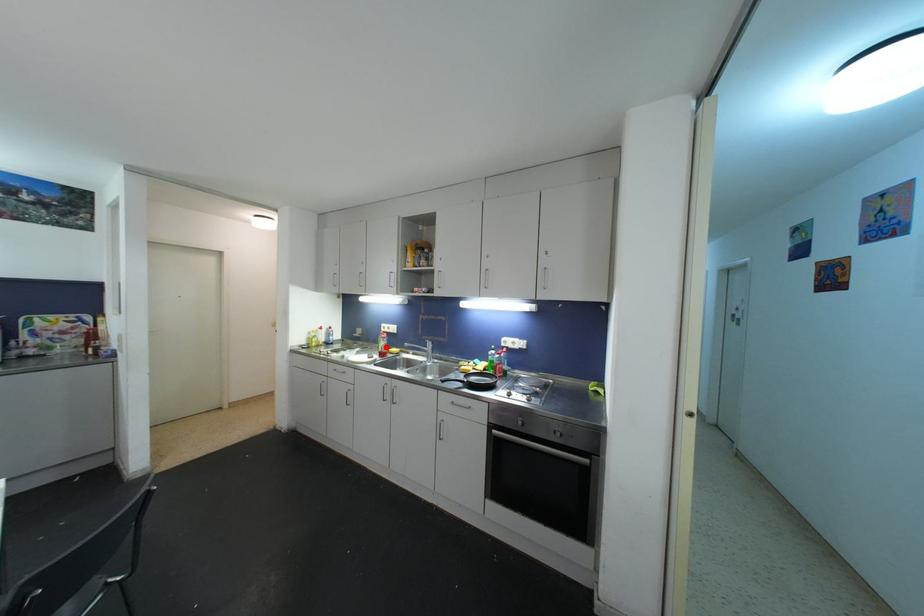
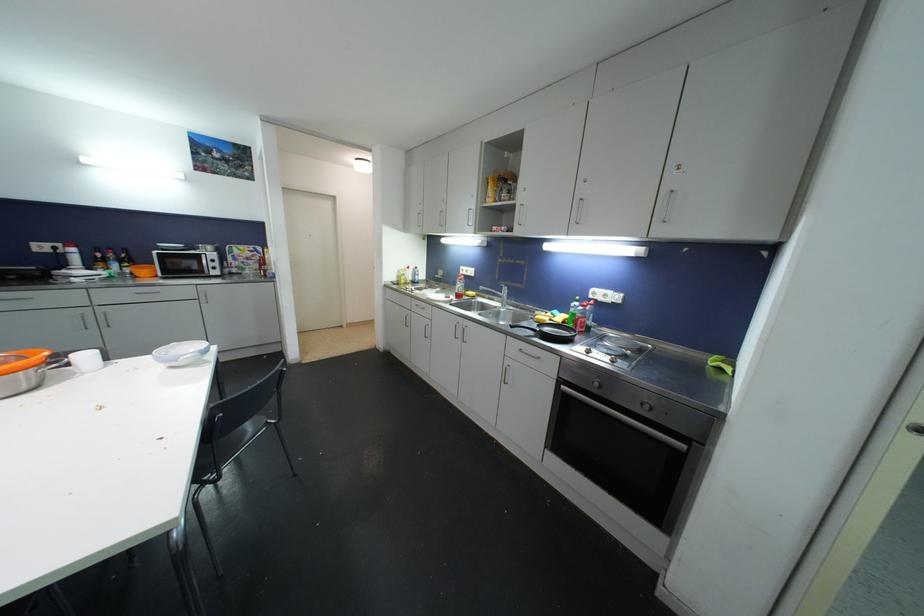
Find the pixel in the second image that matches the highlighted location in the first image.

(463, 288)